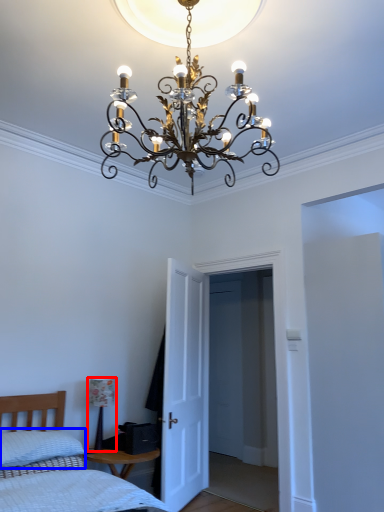
Question: Which object is closer to the camera taking this photo, lamp (highlighted by a red box) or pillow (highlighted by a blue box)?

Choices:
 (A) lamp
 (B) pillow

Answer: (B)